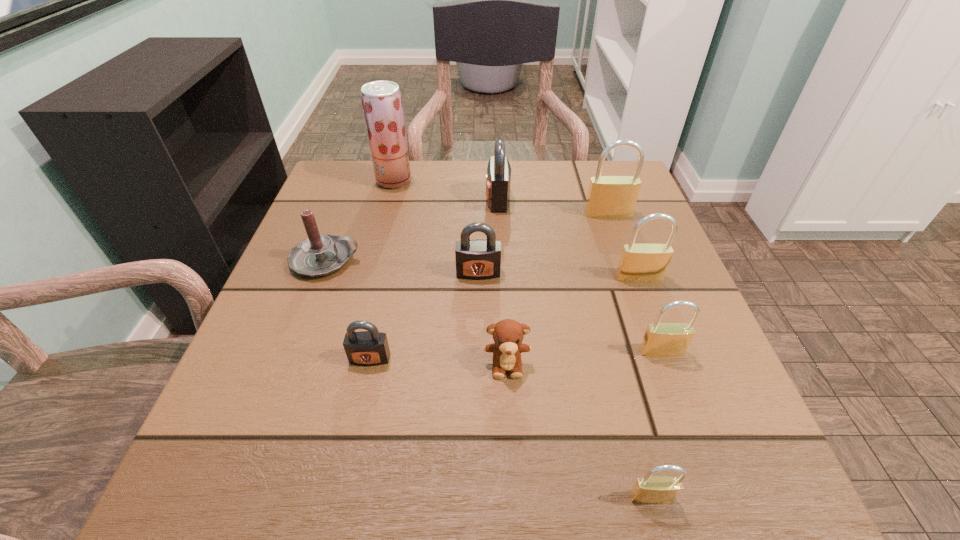
Where is `the tallest object`? This screenshot has width=960, height=540. the tallest object is located at coordinates (382, 103).

Where is `fruit juice`? This screenshot has height=540, width=960. fruit juice is located at coordinates (382, 103).

Image resolution: width=960 pixels, height=540 pixels. Find the location of `the tallest padlock`. the tallest padlock is located at coordinates (608, 196).

Image resolution: width=960 pixels, height=540 pixels. In order to click on the biggest brass padlock in this screenshot , I will do point(608,196).

You are a GUI agent. You are given a task and a screenshot of the screen. Output one action in this format:
    pyautogui.click(x=<x>, y=<y>)
    Task: Click on the farthest gray padlock
    This screenshot has width=960, height=540.
    Given the screenshot: What is the action you would take?
    pyautogui.click(x=498, y=177)

The width and height of the screenshot is (960, 540). What are the coordinates of `the second farthest brass padlock` in the screenshot? It's located at (638, 262).

Find the location of a particular element. This screenshot has width=960, height=540. candle is located at coordinates (318, 255).

Where is `the second biggest gray padlock`? the second biggest gray padlock is located at coordinates (478, 259).

Locate an element on the screen. Image resolution: width=960 pixels, height=540 pixels. the third farthest brass padlock is located at coordinates (661, 339).

Locate an element on the screen. teddy bear is located at coordinates [508, 334].